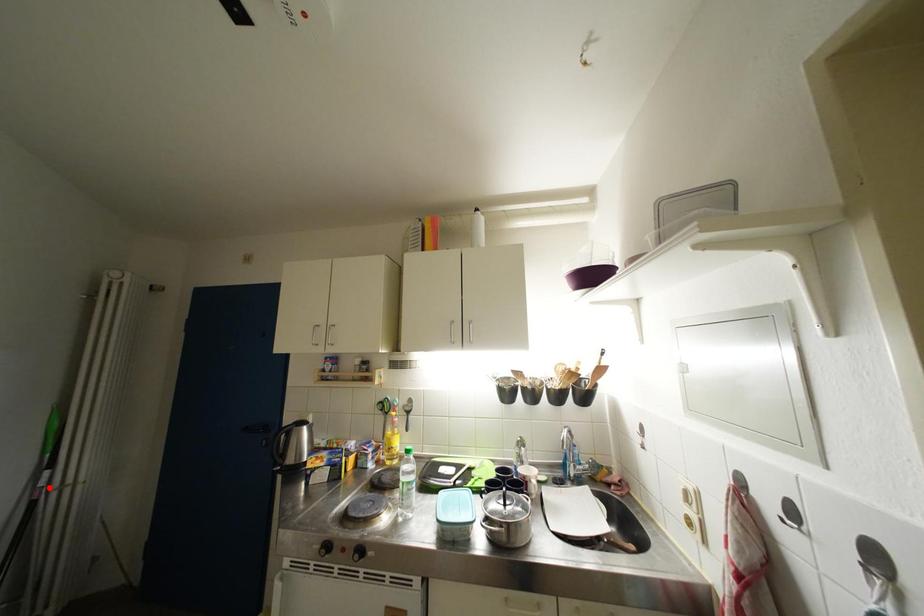
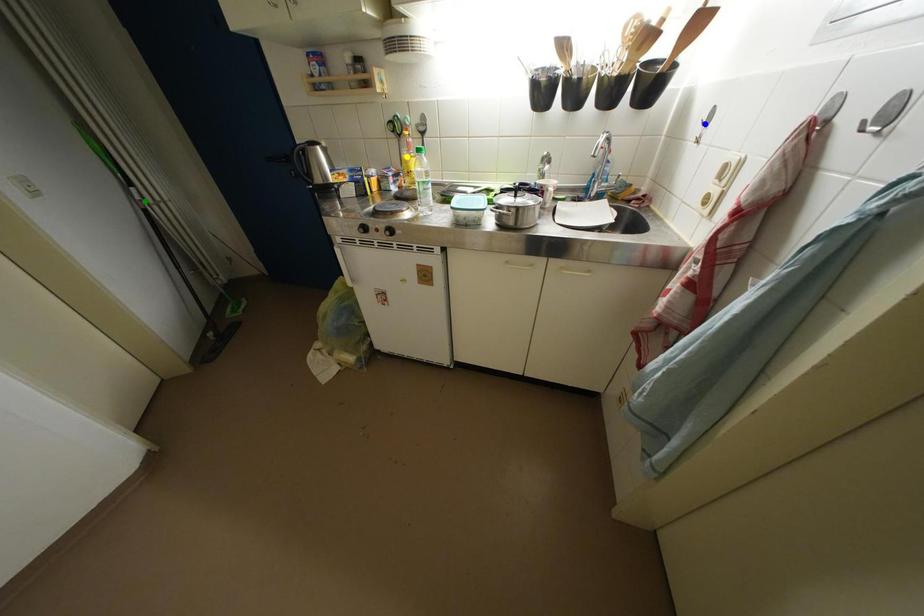
Question: I am providing you with two images of the same scene from different viewpoints. A red point is marked on the first image. You are given multiple points on the second image. Which mark in image 2 goes with the point in image 1?

Choices:
 (A) yellow point
 (B) blue point
 (C) green point

Answer: (C)